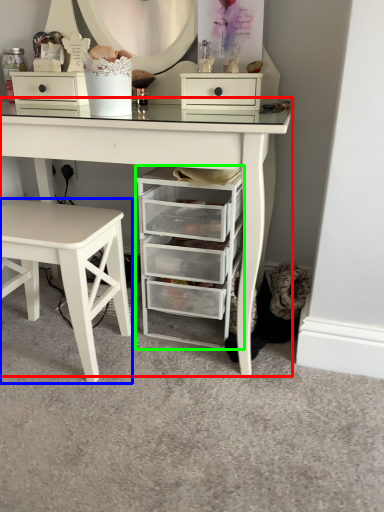
Question: Which is farther away from table (highlighted by a red box)? stool (highlighted by a blue box) or chest of drawers (highlighted by a green box)?

Choices:
 (A) stool
 (B) chest of drawers

Answer: (A)